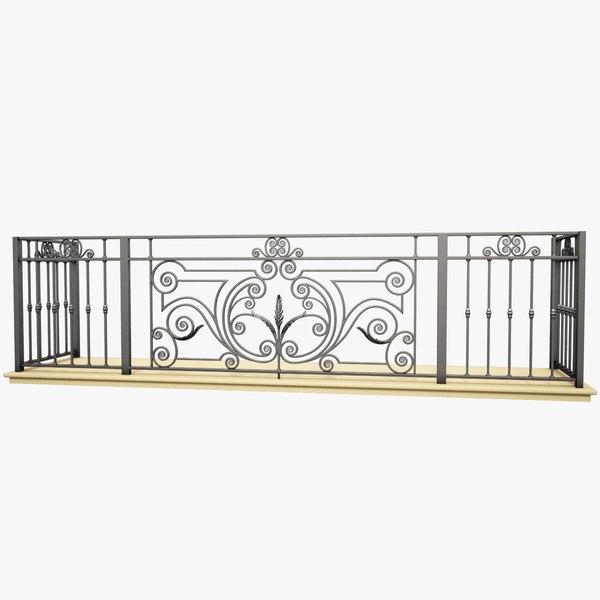
You are a GUI agent. You are given a task and a screenshot of the screen. Output one action in this format:
    pyautogui.click(x=<x>, y=<y>)
    Task: Click on the wood platform
    The image size is (600, 600).
    Given the screenshot: What is the action you would take?
    pyautogui.click(x=525, y=397)